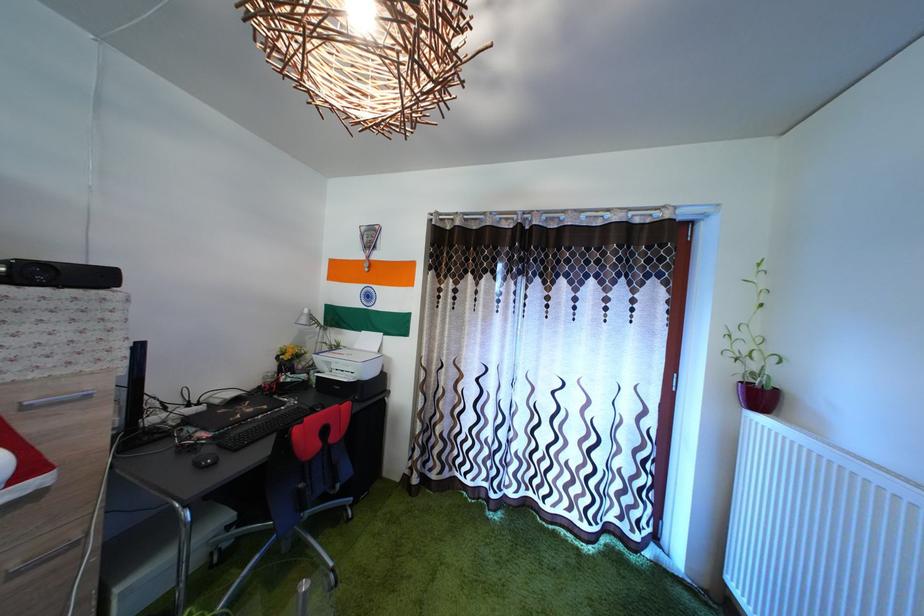
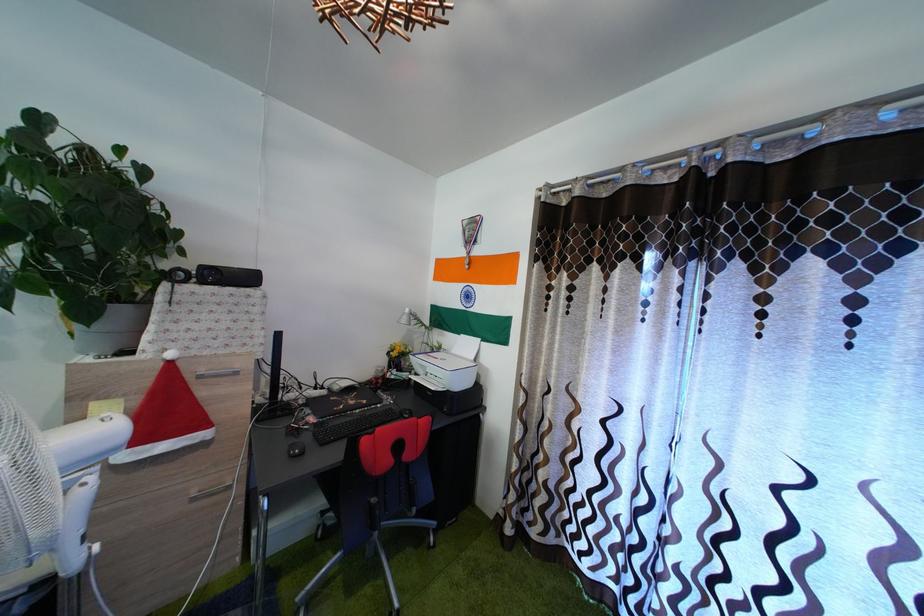
Question: The images are taken continuously from a first-person perspective. In which direction are you moving?

Choices:
 (A) Left
 (B) Right
 (C) Forward
 (D) Backward

Answer: (C)